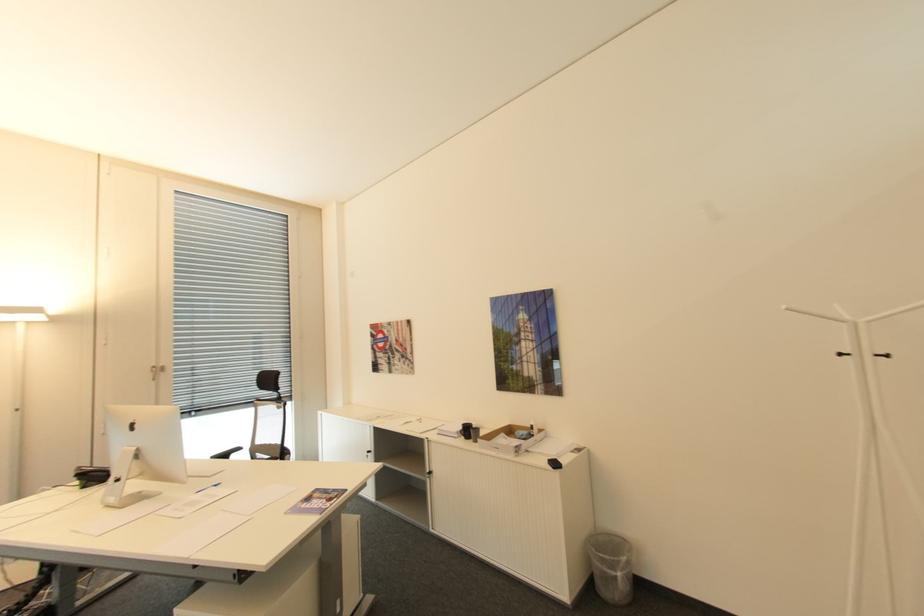
Find the location of a particular element. recessed cabinet handle is located at coordinates (157, 371).